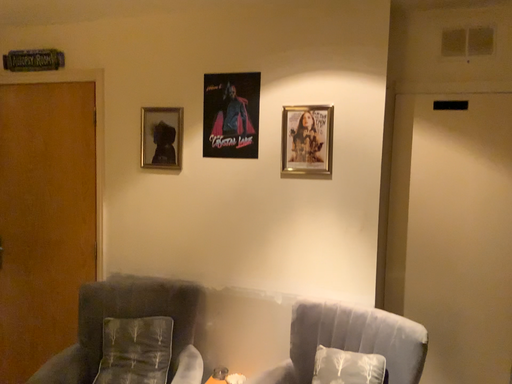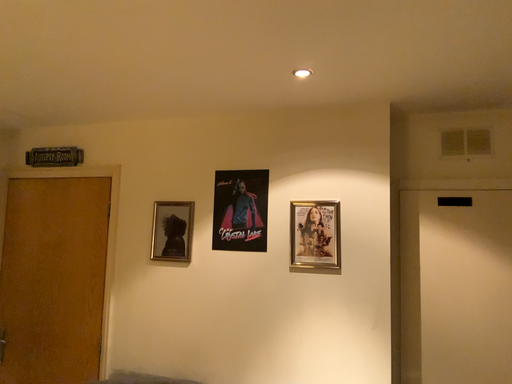
Question: How did the camera likely rotate when shooting the video?

Choices:
 (A) rotated upward
 (B) rotated downward

Answer: (A)